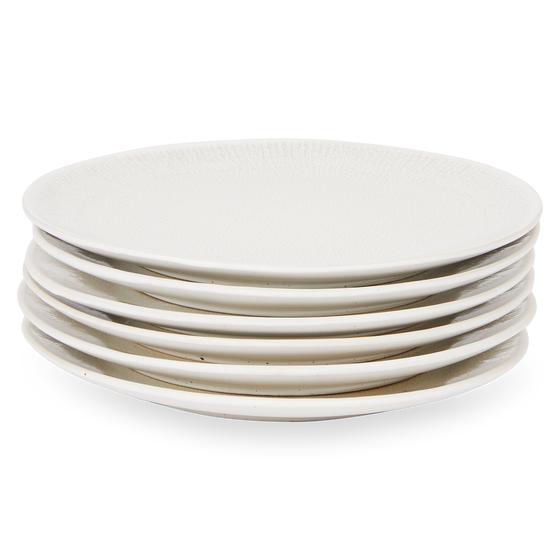
Identify the location of plates. (276, 272), (278, 301), (283, 324), (290, 352), (286, 380), (287, 412).